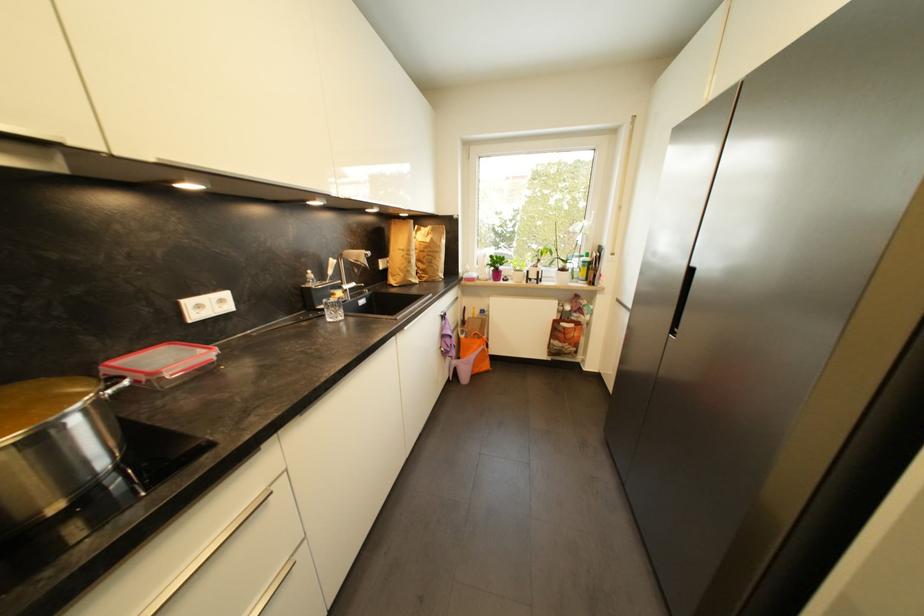
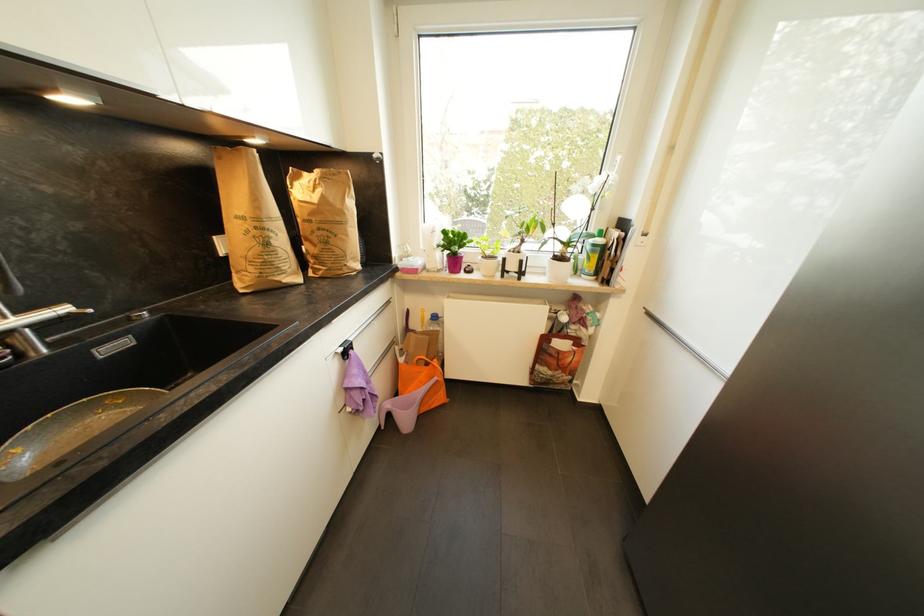
The point at (430, 249) is marked in the first image. Where is the corresponding point in the second image?

(317, 216)